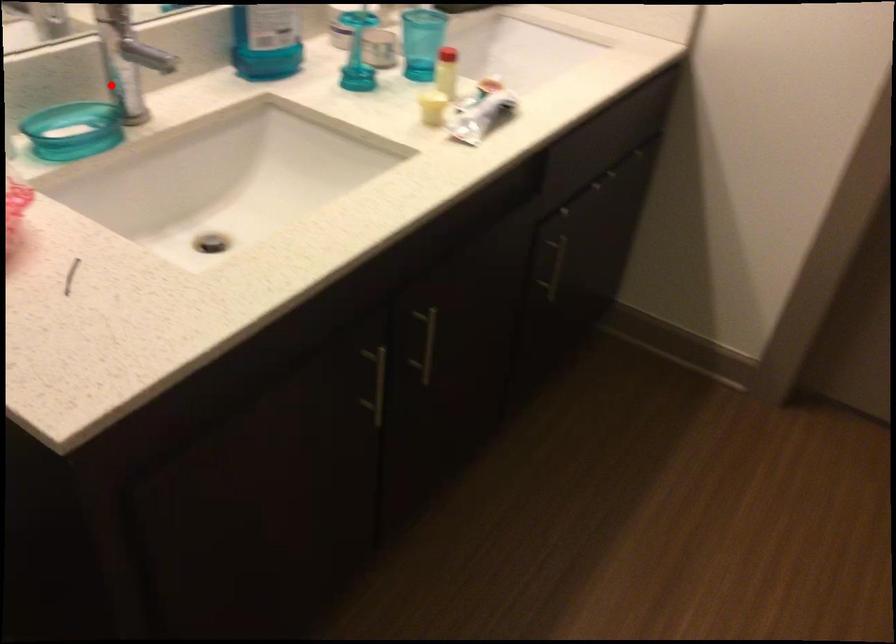
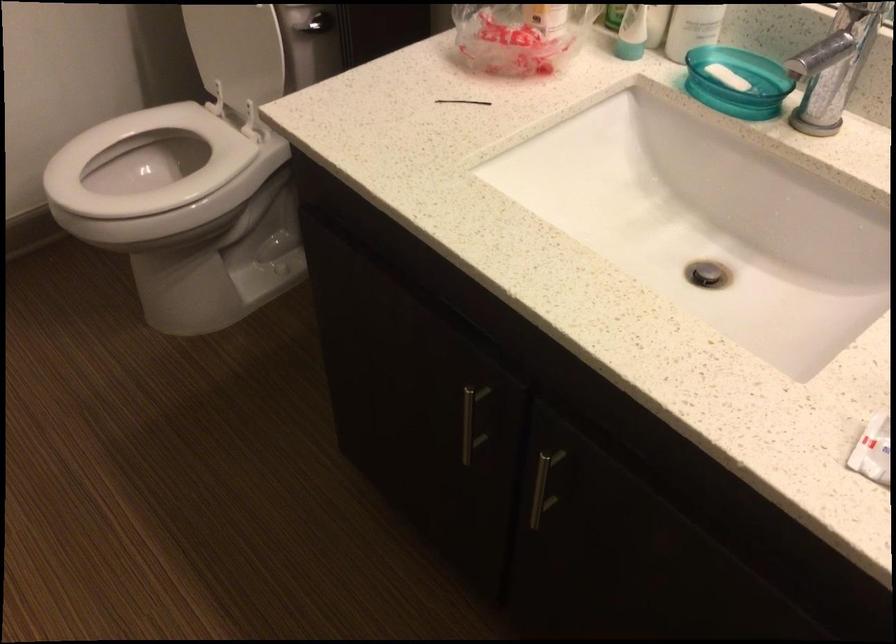
Question: I am providing you with two images of the same scene from different viewpoints. Given a red point in image1, look at the same physical point in image2. Is it:

Choices:
 (A) Closer to the viewpoint
 (B) Farther from the viewpoint

Answer: (A)